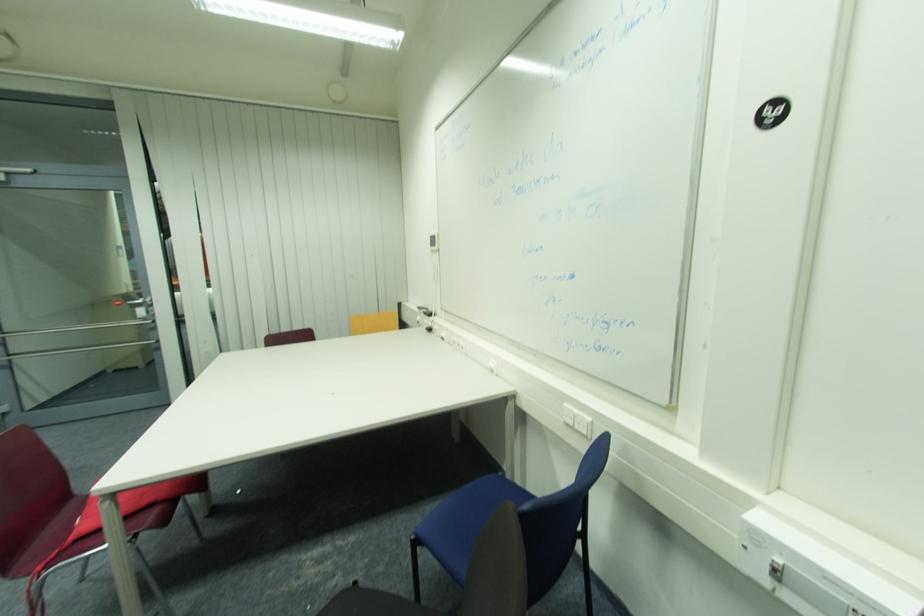
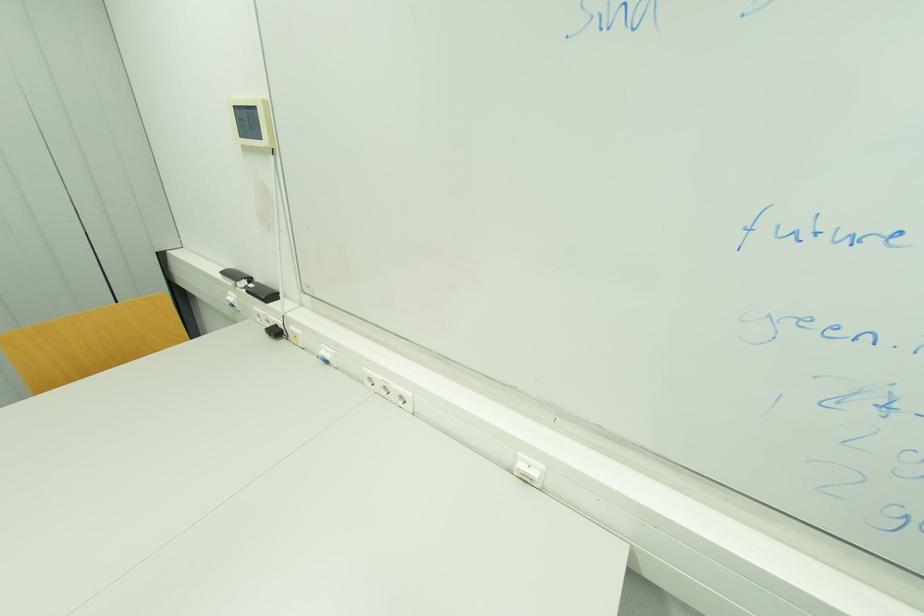
Find the pixel in the second image that matches point 446,339 in the first image.

(330, 362)